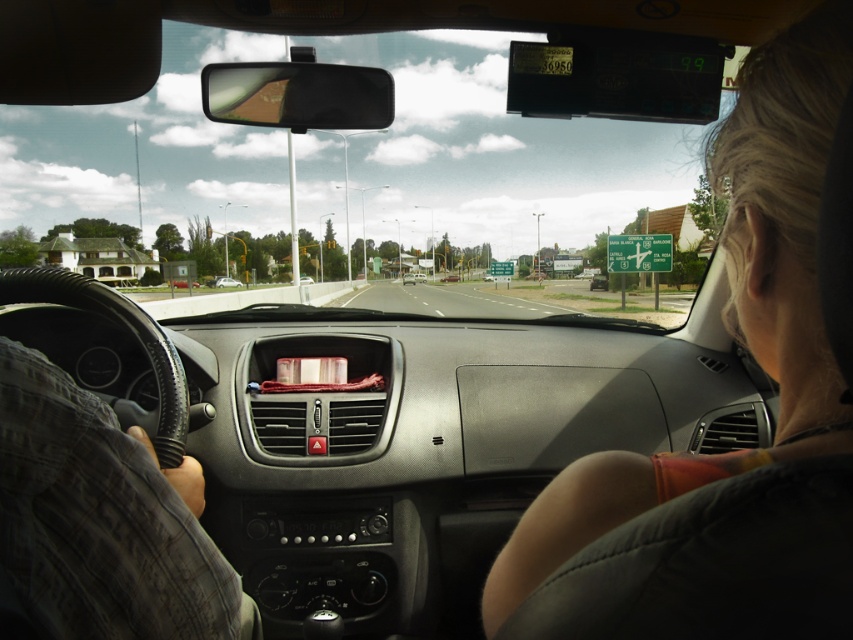
Based on the photo, you are a passenger in the car and want to look at the road ahead through the transparent glass windshield at center and the blonde hair at upper right. Which object allows you to see the road more clearly?

The transparent glass windshield at center allows you to see the road more clearly because it is larger in size than the blonde hair at upper right.

You are a passenger in the car and want to point out the blonde hair at upper right to the driver. Where should you tell them to look?

You should tell the driver to look at the upper right area of the windshield where the blonde hair at upper right is located.

You are a passenger in the car and want to describe the scene outside to someone who can only see the size of objects. Which object in the image, the blonde hair at upper right or the metallic silver sedan at center, appears larger?

The blonde hair at upper right appears larger than the metallic silver sedan at center in the image.